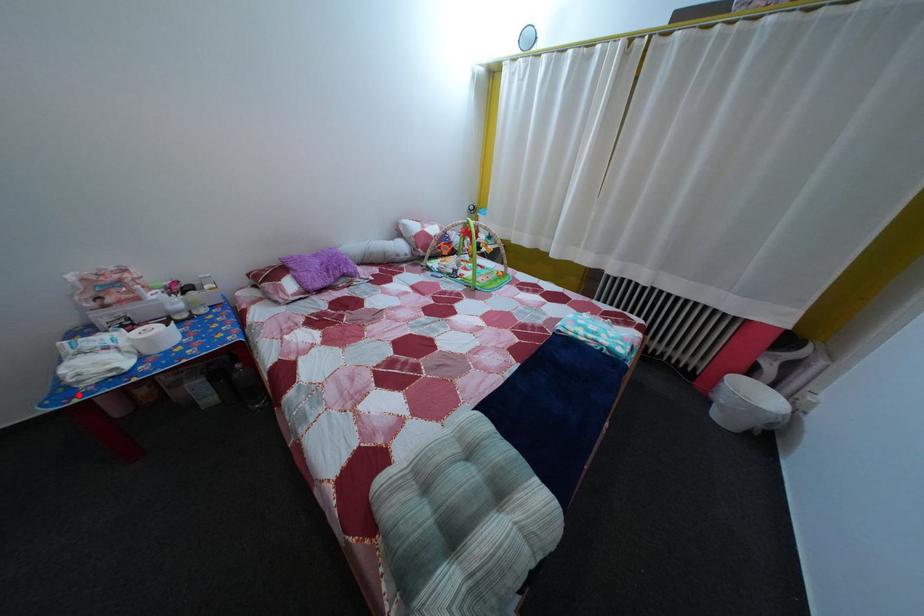
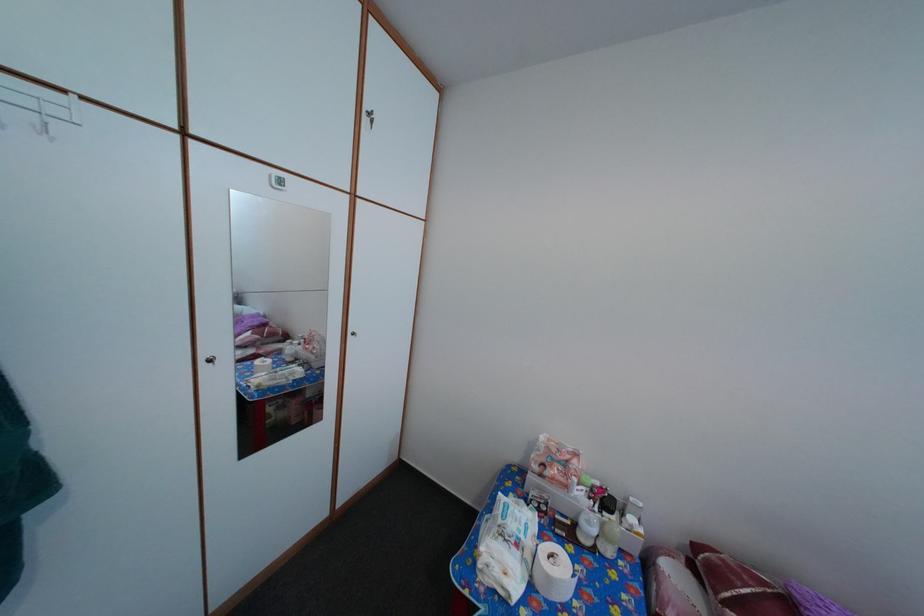
Question: I am providing you with two images of the same scene from different viewpoints. Image1 has a red point marked. In image2, the corresponding 3D location appears at what relative position? Reply with the corresponding letter.

Choices:
 (A) Closer
 (B) Farther

Answer: (B)